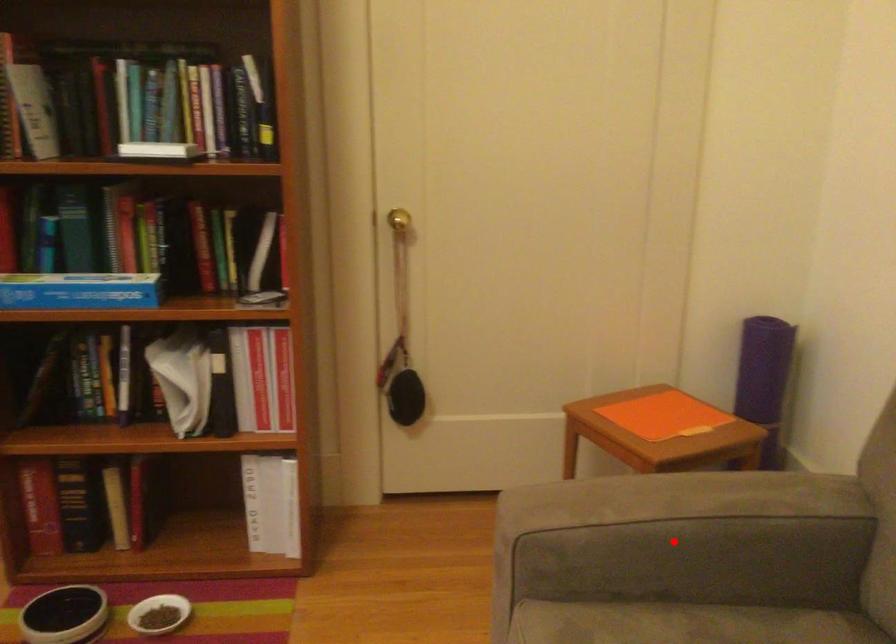
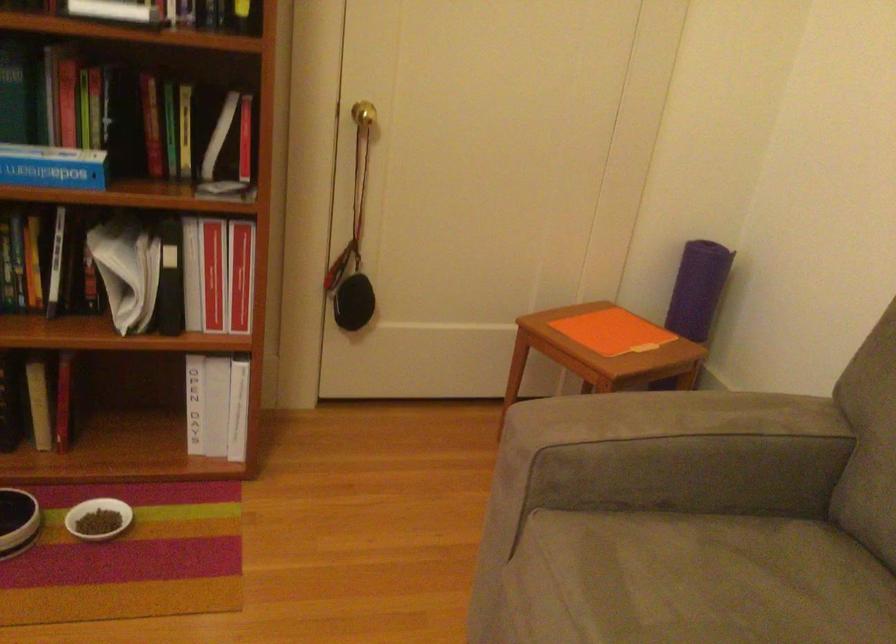
Where in the second image is the point corresponding to the highlighted location from the first image?

(675, 453)